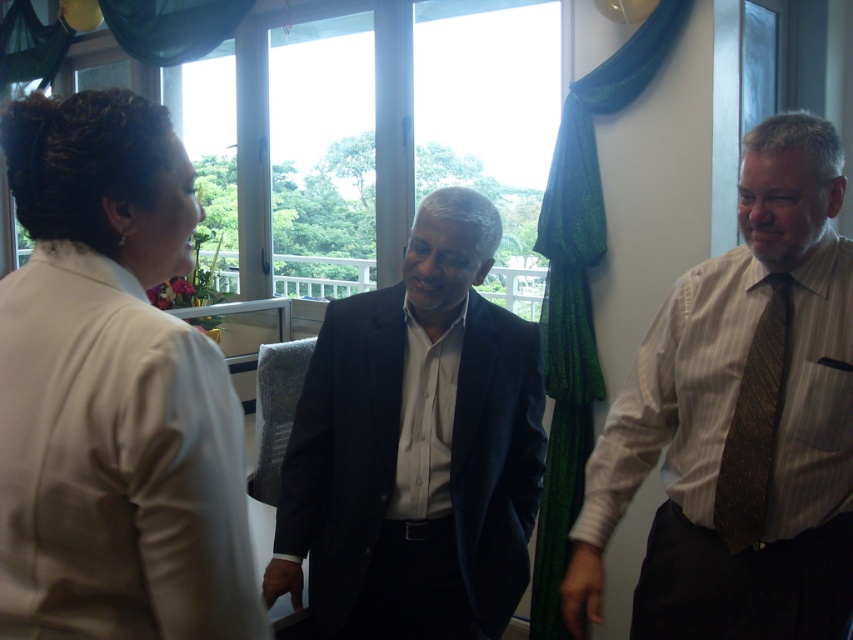
You are standing at the entrance of the room and want to approach the striped cotton shirt at right. Which direction should you move to reach it?

The striped cotton shirt at right is located at point 0.659 on the x axis and 0.869 on the y axis. Since you are at the entrance, you should move towards the right side of the room to reach the striped cotton shirt at right.

You are a fashion designer observing the scene. You need to determine if the white satin blouse at upper left can be draped over the green shimmering curtain at center without overlapping its edges. Can it fit horizontally?

The white satin blouse at upper left is narrower than the green shimmering curtain at center, so it can be draped over the curtain without overlapping its edges.

You are a photographer setting up for a group photo. You need to ensure that the green shimmering curtain at center and the brown textured tie at right are both visible in the frame. Given their sizes, which object will require more horizontal space in the composition?

The green shimmering curtain at center requires more horizontal space in the composition because its width is larger than that of the brown textured tie at right.